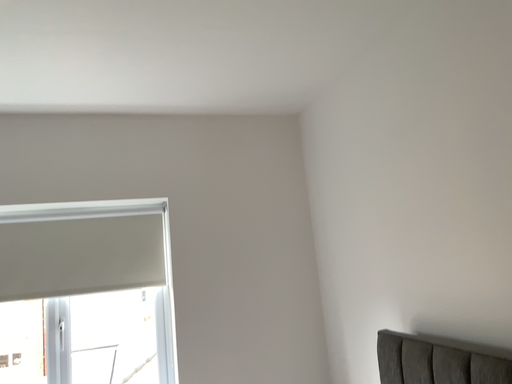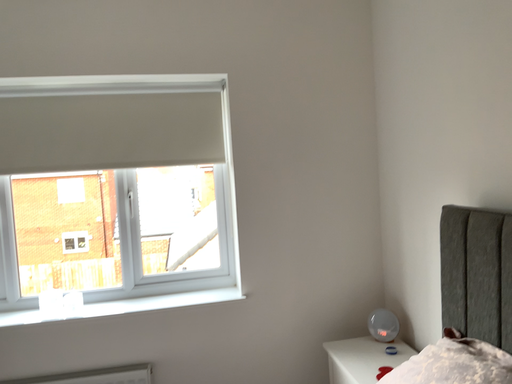
Question: How did the camera likely rotate when shooting the video?

Choices:
 (A) rotated right
 (B) rotated left

Answer: (B)